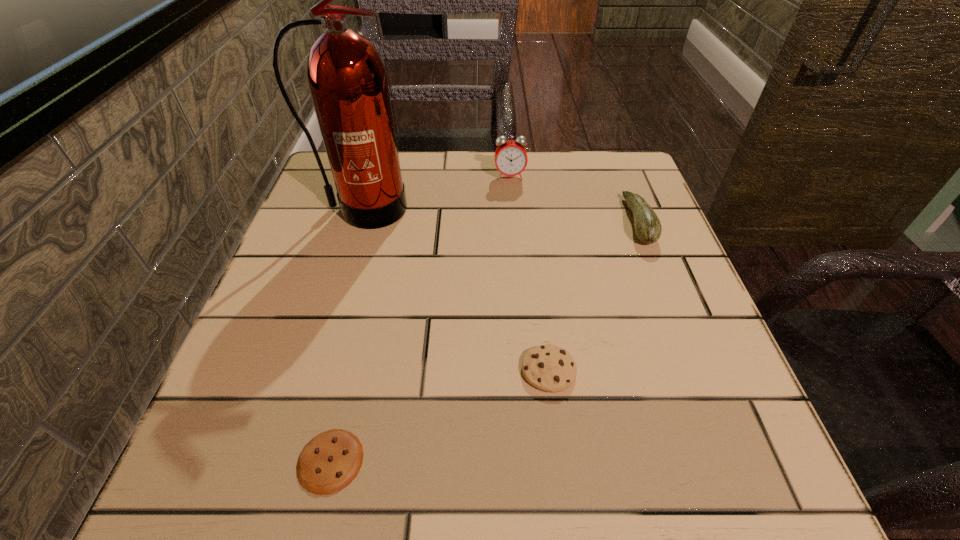
Find the location of a particular element. fire extinguisher situated at the left edge is located at coordinates (347, 79).

The width and height of the screenshot is (960, 540). I want to click on cookie present at the left edge, so click(329, 462).

Find the location of a particular element. The width and height of the screenshot is (960, 540). object present at the right edge is located at coordinates (648, 228).

This screenshot has height=540, width=960. What are the coordinates of `object at the far left corner` in the screenshot? It's located at (347, 79).

In order to click on object present at the near left corner in this screenshot , I will do `click(329, 462)`.

What are the coordinates of `object at the far right corner` in the screenshot? It's located at (648, 228).

Where is `vacant space at the far edge of the desktop`? The image size is (960, 540). vacant space at the far edge of the desktop is located at coordinates (444, 157).

The height and width of the screenshot is (540, 960). In order to click on blank space at the left edge of the desktop in this screenshot , I will do `click(329, 380)`.

Locate an element on the screen. vacant space at the right edge of the desktop is located at coordinates (613, 226).

At what (x,y) coordinates should I click in order to perform the action: click on vacant space at the near left corner. Please return your answer as a coordinate pair (x, y). Looking at the image, I should click on (285, 484).